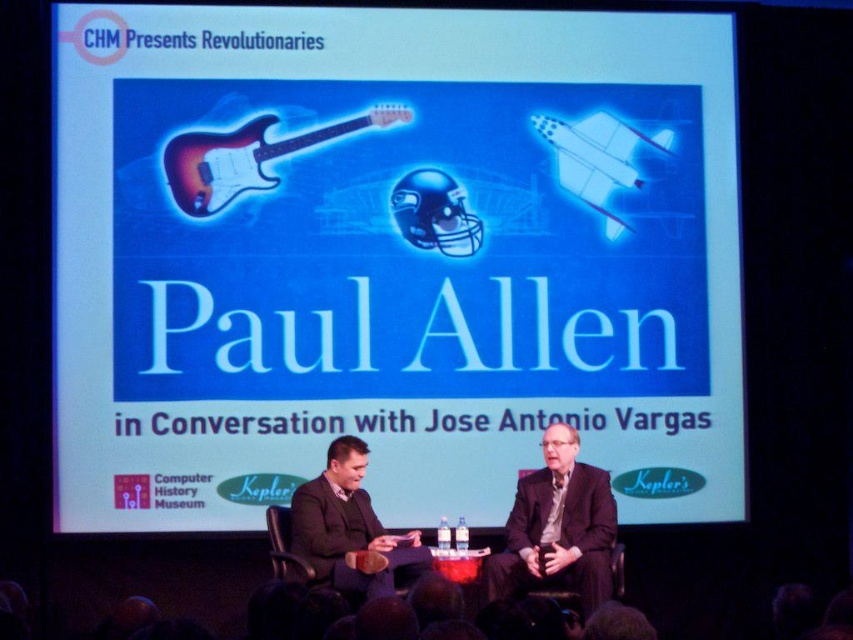
You are an event photographer positioned at the back of the stage. You need to capture a photo where both the dark suit at center and the dark gray suit at center are visible. Based on their positions, which one should you ensure is closer to the left side of your camera frame?

The dark gray suit at center is to the left of the dark suit at center, so you should ensure the dark gray suit at center is closer to the left side of your camera frame.

You are attending the CHM event and notice two individuals on stage wearing suits. The scene shows a dark suit at center and a dark gray suit at center. Which one is larger in size?

The dark suit at center is bigger than the dark gray suit at center.

Consider the image. You are an event planner trying to place a spotlight on the blue glossy text at center. Where should you aim the spotlight to ensure it hits the text?

You should aim the spotlight at point (390, 259) to hit the blue glossy text at center.